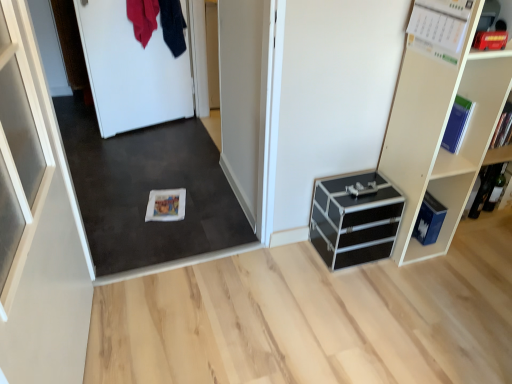
Question: Does black aluminum chest of drawers at lower right have a lesser width compared to white paper calendar at upper right, placed as the fourth book when sorted from bottom to top?

Choices:
 (A) yes
 (B) no

Answer: (B)

Question: From a real-world perspective, is black aluminum chest of drawers at lower right under white paper calendar at upper right, placed as the 2th book when sorted from left to right?

Choices:
 (A) no
 (B) yes

Answer: (B)

Question: Can you confirm if black aluminum chest of drawers at lower right is positioned to the right of white paper calendar at upper right, placed as the 1th book when sorted from top to bottom?

Choices:
 (A) no
 (B) yes

Answer: (A)

Question: Is white paper calendar at upper right, positioned as the first book in front-to-back order, surrounded by black aluminum chest of drawers at lower right?

Choices:
 (A) yes
 (B) no

Answer: (B)

Question: From a real-world perspective, is black aluminum chest of drawers at lower right physically above white paper calendar at upper right, positioned as the first book in front-to-back order?

Choices:
 (A) yes
 (B) no

Answer: (B)

Question: Is black aluminum chest of drawers at lower right not within white paper calendar at upper right, placed as the 3th book when sorted from right to left?

Choices:
 (A) yes
 (B) no

Answer: (A)

Question: Is the position of white matte book at center, arranged as the 1th book when viewed from the left, less distant than that of white paper calendar at upper right, arranged as the fourth book when viewed from the back?

Choices:
 (A) no
 (B) yes

Answer: (A)

Question: From a real-world perspective, is white matte book at center, the first book in the bottom-to-top sequence, below white paper calendar at upper right, placed as the 3th book when sorted from right to left?

Choices:
 (A) yes
 (B) no

Answer: (A)

Question: Can you confirm if white matte book at center, which ranks as the first book in back-to-front order, is thinner than white paper calendar at upper right, placed as the 2th book when sorted from left to right?

Choices:
 (A) yes
 (B) no

Answer: (B)

Question: Is white matte book at center, which is counted as the fourth book, starting from the top, shorter than white paper calendar at upper right, placed as the 2th book when sorted from left to right?

Choices:
 (A) yes
 (B) no

Answer: (A)

Question: Is white matte book at center, the fourth book when ordered from right to left, with white paper calendar at upper right, arranged as the fourth book when viewed from the back?

Choices:
 (A) yes
 (B) no

Answer: (B)

Question: Does white matte book at center, which is counted as the fourth book, starting from the top, turn towards white paper calendar at upper right, placed as the 3th book when sorted from right to left?

Choices:
 (A) no
 (B) yes

Answer: (A)

Question: Does blue matte book at upper right, the third book in the back-to-front sequence, appear on the left side of white paper calendar at upper right, arranged as the fourth book when viewed from the back?

Choices:
 (A) yes
 (B) no

Answer: (B)